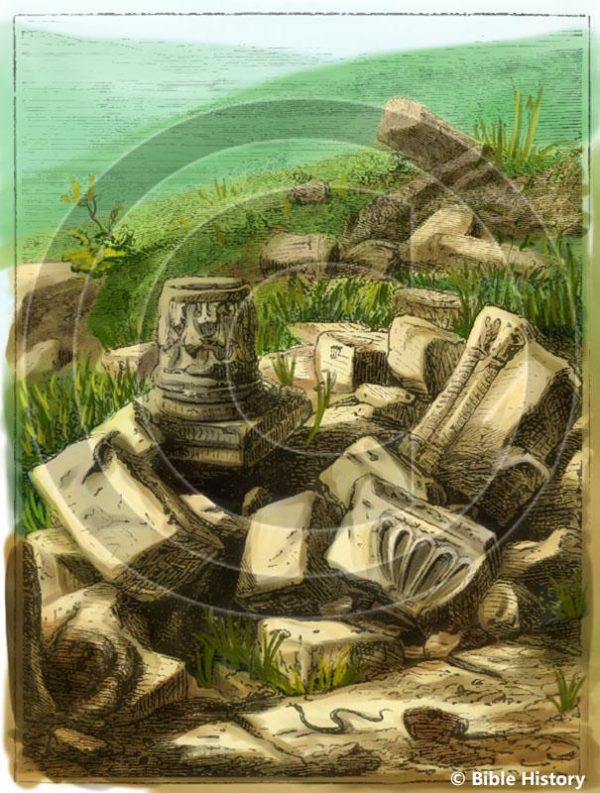
Locate an element on the screen. vase is located at coordinates (209, 320).